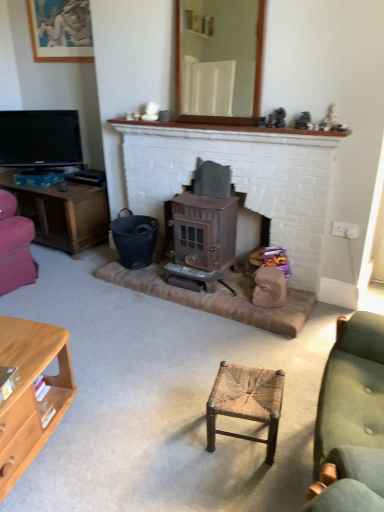
Question: Is light brown wood cabinet at lower left to the left of green fabric couch at right from the viewer's perspective?

Choices:
 (A) yes
 (B) no

Answer: (A)

Question: Is light brown wood cabinet at lower left shorter than green fabric couch at right?

Choices:
 (A) no
 (B) yes

Answer: (B)

Question: Is light brown wood cabinet at lower left thinner than green fabric couch at right?

Choices:
 (A) no
 (B) yes

Answer: (A)

Question: From the image's perspective, is light brown wood cabinet at lower left over green fabric couch at right?

Choices:
 (A) yes
 (B) no

Answer: (B)

Question: Can you confirm if light brown wood cabinet at lower left is wider than green fabric couch at right?

Choices:
 (A) no
 (B) yes

Answer: (B)

Question: Is light brown wood cabinet at lower left bigger than green fabric couch at right?

Choices:
 (A) no
 (B) yes

Answer: (A)

Question: Is light brown wood cabinet at lower left facing towards black plastic bucket at lower left?

Choices:
 (A) yes
 (B) no

Answer: (B)

Question: From a real-world perspective, is light brown wood cabinet at lower left positioned under black plastic bucket at lower left based on gravity?

Choices:
 (A) yes
 (B) no

Answer: (A)

Question: Is light brown wood cabinet at lower left smaller than black plastic bucket at lower left?

Choices:
 (A) yes
 (B) no

Answer: (B)

Question: Does light brown wood cabinet at lower left lie behind black plastic bucket at lower left?

Choices:
 (A) no
 (B) yes

Answer: (A)

Question: Considering the relative sizes of light brown wood cabinet at lower left and black plastic bucket at lower left in the image provided, is light brown wood cabinet at lower left bigger than black plastic bucket at lower left?

Choices:
 (A) no
 (B) yes

Answer: (B)

Question: Considering the relative positions of light brown wood cabinet at lower left and black plastic bucket at lower left in the image provided, is light brown wood cabinet at lower left to the left of black plastic bucket at lower left from the viewer's perspective?

Choices:
 (A) no
 (B) yes

Answer: (B)

Question: Is woven wood stool at center outside green fabric couch at right?

Choices:
 (A) yes
 (B) no

Answer: (A)